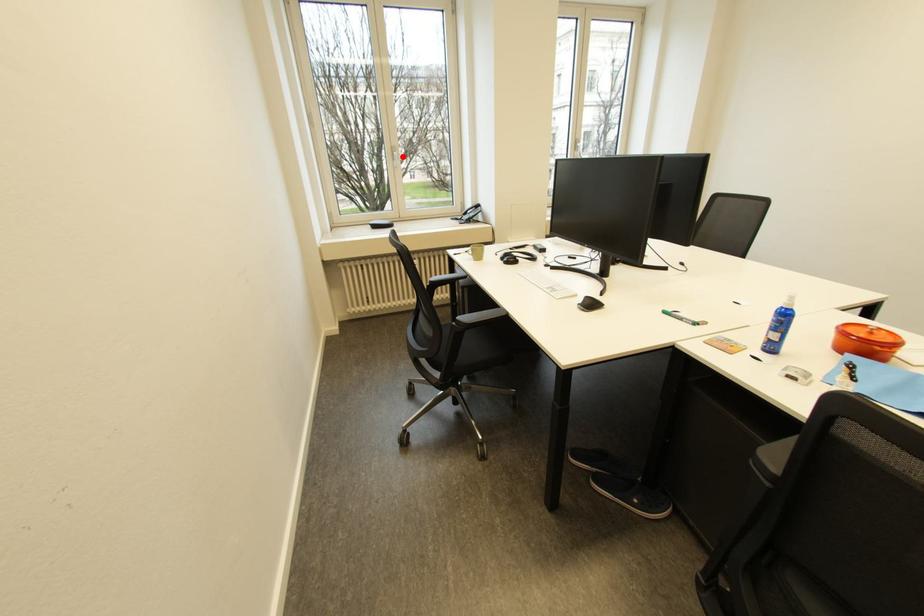
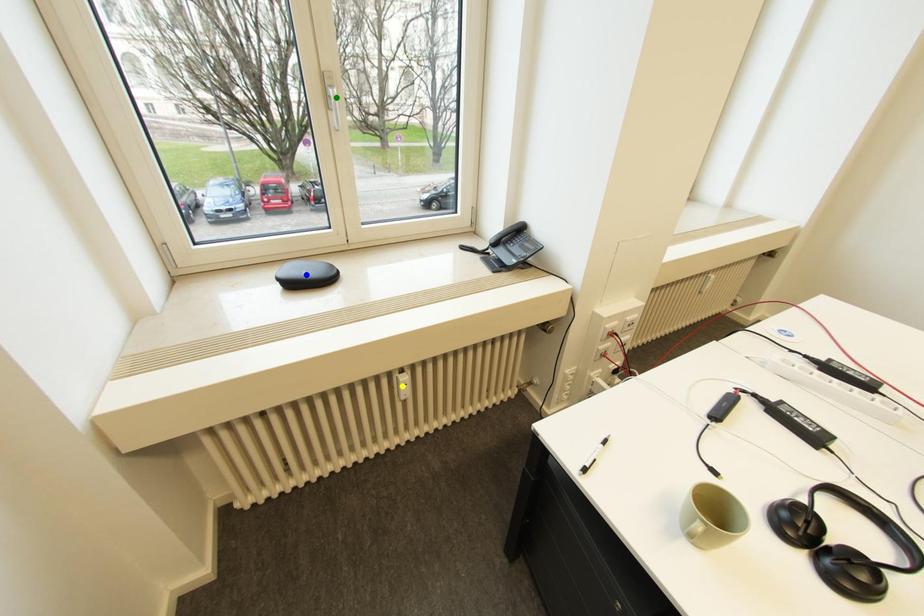
Question: I am providing you with two images of the same scene from different viewpoints. A red point is marked on the first image. You are given multiple points on the second image. Which mark in image 2 goes with the point in image 1?

Choices:
 (A) yellow point
 (B) green point
 (C) blue point

Answer: (B)